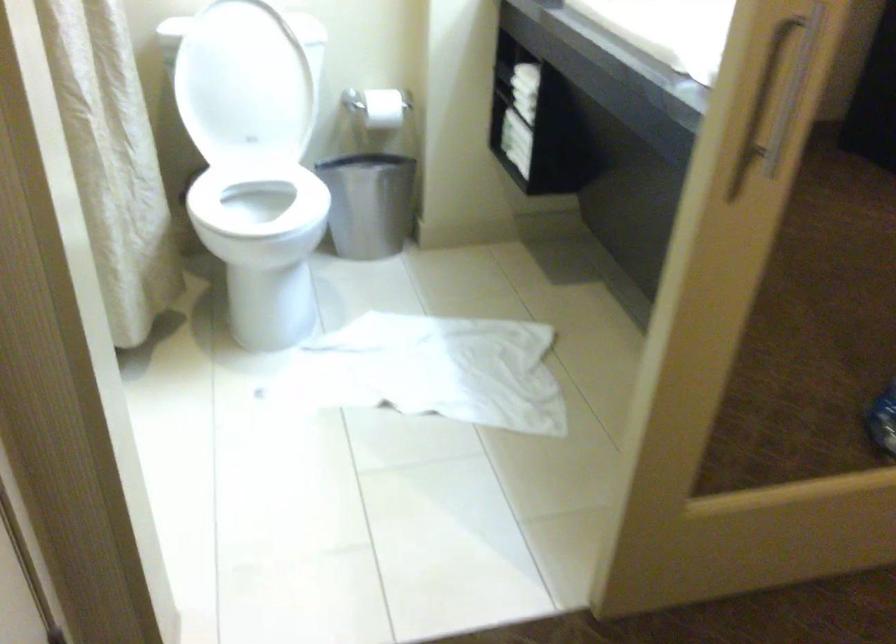
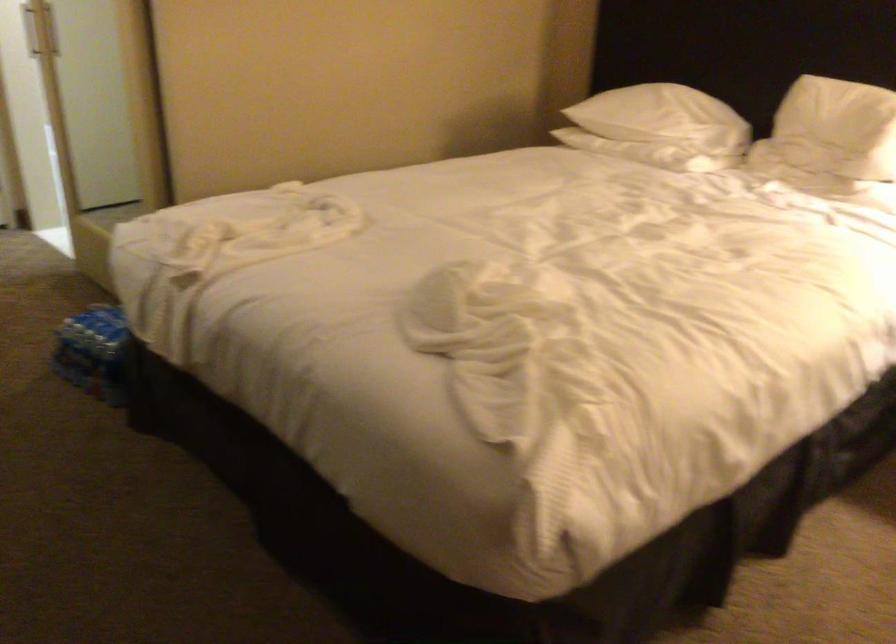
Question: I am providing you with two images of the same scene from different viewpoints. Please identify which objects are invisible in image2.

Choices:
 (A) white pillow
 (B) toilet paper roll
 (C) plastic water bottle
 (D) bed frame rail

Answer: (B)